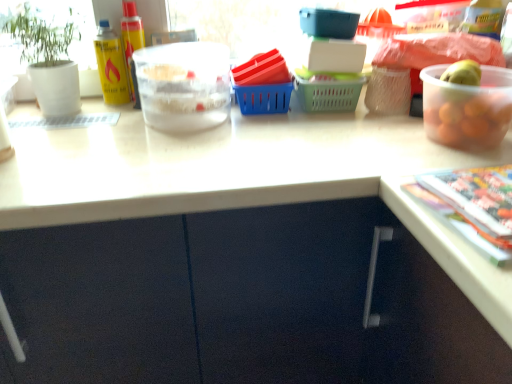
Question: Is transparent plastic bowl at upper right, which is the second bowl in back-to-front order, inside the boundaries of multicolored glossy magazine at lower right, or outside?

Choices:
 (A) outside
 (B) inside

Answer: (A)

Question: Considering the positions of transparent plastic bowl at upper right, which is the second bowl in back-to-front order, and multicolored glossy magazine at lower right in the image, is transparent plastic bowl at upper right, which is the second bowl in back-to-front order, taller or shorter than multicolored glossy magazine at lower right?

Choices:
 (A) short
 (B) tall

Answer: (B)

Question: Estimate the real-world distances between objects in this image. Which object is farther from the translucent plastic bowl at upper center, acting as the 1th bowl starting from the left?

Choices:
 (A) green matte plant pot at left
 (B) multicolored glossy magazine at lower right
 (C) transparent plastic bowl at upper right, placed as the first bowl when sorted from right to left

Answer: (B)

Question: Which object is positioned closest to the green matte plant pot at left?

Choices:
 (A) multicolored glossy magazine at lower right
 (B) transparent plastic bowl at upper right, placed as the 2th bowl when sorted from left to right
 (C) translucent plastic bowl at upper center, positioned as the 2th bowl in front-to-back order

Answer: (C)